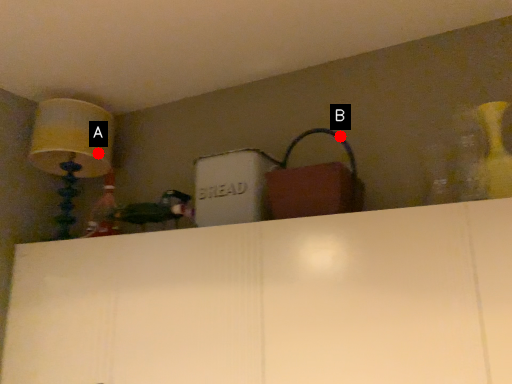
Question: Two points are circled on the image, labeled by A and B beside each circle. Which point appears farthest from the camera in this image?

Choices:
 (A) A is further
 (B) B is further

Answer: (A)